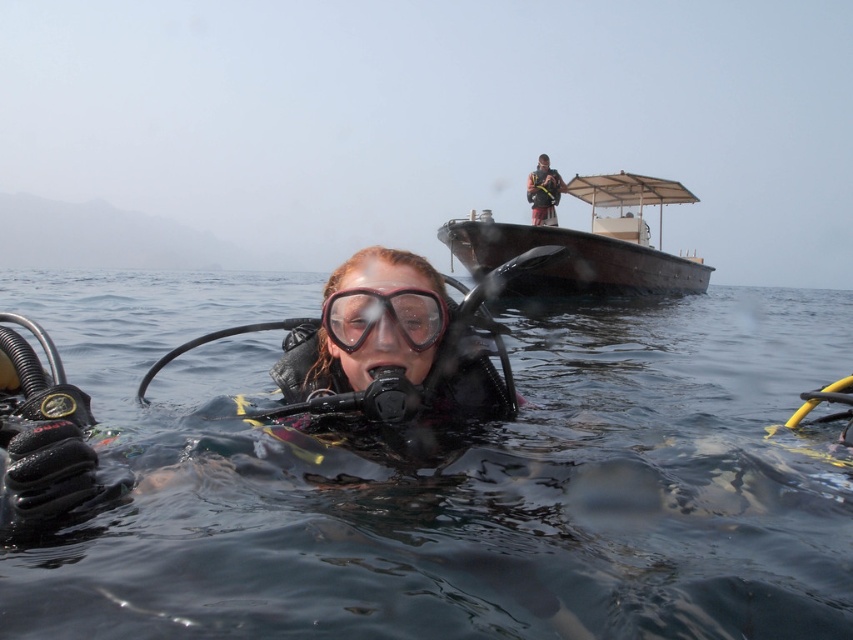
Question: From the image, what is the correct spatial relationship of transparent rubber goggles at center in relation to dark blue fabric at upper center?

Choices:
 (A) left
 (B) right

Answer: (A)

Question: Among these objects, which one is farthest from the camera?

Choices:
 (A) wooden boat at upper center
 (B) transparent rubber goggles at center

Answer: (A)

Question: Is transparent water at center further to the viewer compared to dark blue fabric at upper center?

Choices:
 (A) yes
 (B) no

Answer: (B)

Question: Which is farther from the wooden boat at upper center?

Choices:
 (A) dark blue fabric at upper center
 (B) transparent water at center
 (C) transparent rubber goggles at center

Answer: (C)

Question: Is wooden boat at upper center positioned at the back of transparent rubber goggles at center?

Choices:
 (A) yes
 (B) no

Answer: (A)

Question: Among these points, which one is farthest from the camera?

Choices:
 (A) (164, 456)
 (B) (546, 204)

Answer: (B)